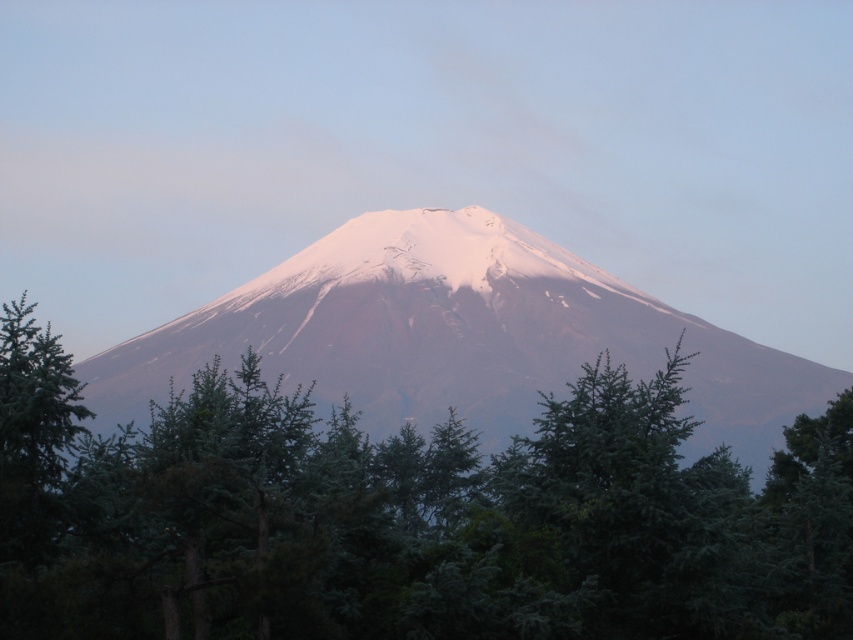
Question: Can you confirm if green textured trees at center is bigger than white snow-covered mountain at center?

Choices:
 (A) yes
 (B) no

Answer: (A)

Question: Is green textured trees at center further to the viewer compared to white snow-covered mountain at center?

Choices:
 (A) no
 (B) yes

Answer: (A)

Question: Is green textured trees at center positioned in front of white snow-covered mountain at center?

Choices:
 (A) yes
 (B) no

Answer: (A)

Question: Which of the following is the farthest from the observer?

Choices:
 (A) (286, 291)
 (B) (273, 424)

Answer: (A)